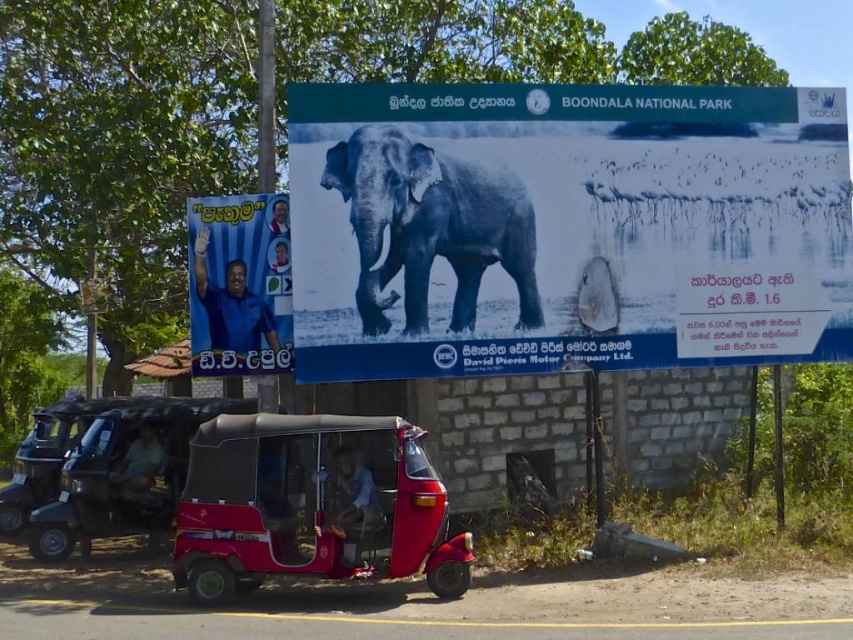
Question: Which point is closer to the camera?

Choices:
 (A) black plastic golf cart at lower left
 (B) shiny red tuk-tuk at center

Answer: (B)

Question: Observing the image, what is the correct spatial positioning of shiny red tuk-tuk at center in reference to gray textured elephant at center?

Choices:
 (A) above
 (B) below

Answer: (B)

Question: Which point is farther to the camera?

Choices:
 (A) shiny red tuk-tuk at center
 (B) blue fabric poster at left

Answer: (B)

Question: Is black and white elephant at center to the left of gray textured elephant at center from the viewer's perspective?

Choices:
 (A) yes
 (B) no

Answer: (B)

Question: Which of the following is the farthest from the observer?

Choices:
 (A) (273, 323)
 (B) (373, 284)
 (C) (339, 532)
 (D) (254, 397)

Answer: (D)

Question: Can you confirm if black and white elephant at center is wider than shiny red tuk-tuk at center?

Choices:
 (A) yes
 (B) no

Answer: (B)